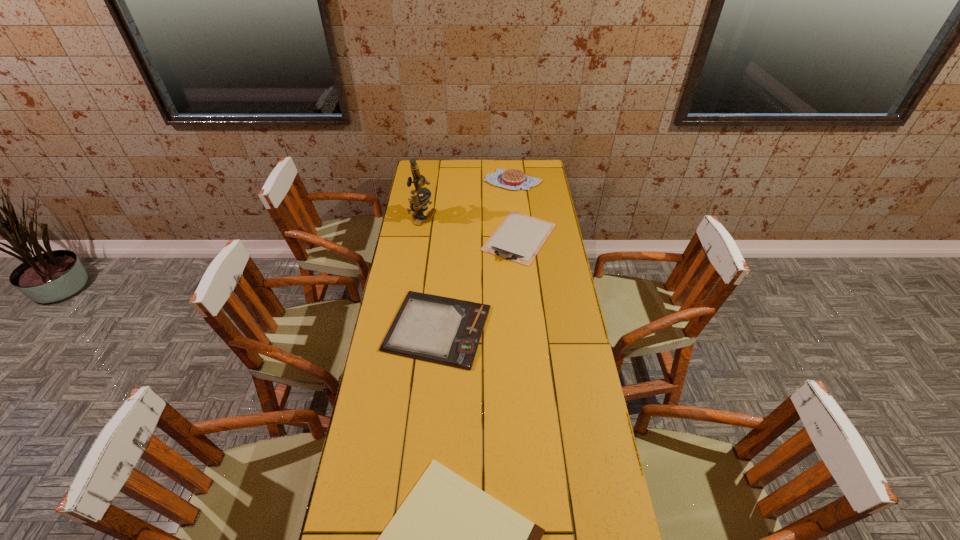
Where is `microscope`? Image resolution: width=960 pixels, height=540 pixels. microscope is located at coordinates (418, 204).

This screenshot has height=540, width=960. What are the coordinates of `pie` in the screenshot? It's located at pos(513,179).

This screenshot has height=540, width=960. I want to click on the farthest object, so [x=513, y=179].

Find the location of a particular element. the farthest clipboard is located at coordinates (519, 237).

Identify the location of the second farthest clipboard. This screenshot has height=540, width=960. (447, 331).

Locate an element on the screen. The width and height of the screenshot is (960, 540). vacant space located 0.300m on the back of the microscope is located at coordinates (428, 177).

Locate an element on the screen. The width and height of the screenshot is (960, 540). vacant space located on the left of the farthest object is located at coordinates (428, 180).

The height and width of the screenshot is (540, 960). In order to click on free point located on the front of the farthest clipboard in this screenshot , I will do `click(529, 330)`.

You are a GUI agent. You are given a task and a screenshot of the screen. Output one action in this format:
    pyautogui.click(x=<x>, y=<y>)
    Task: Click on the blank area located 0.250m on the right of the second nearest clipboard
    This screenshot has height=540, width=960.
    Given the screenshot: What is the action you would take?
    pyautogui.click(x=558, y=328)

This screenshot has height=540, width=960. What are the coordinates of `object that is at the far edge` in the screenshot? It's located at coord(513,179).